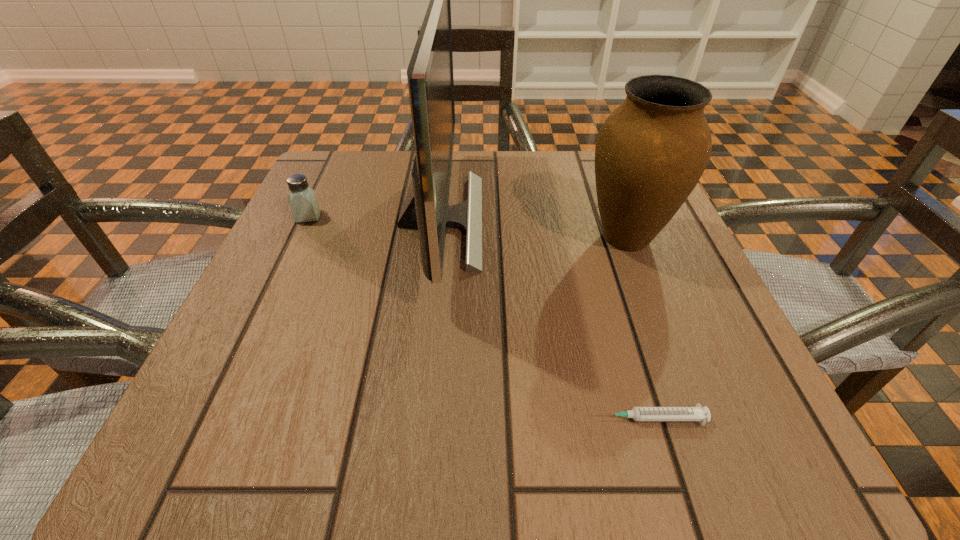
At what (x,y) coordinates should I click in order to perform the action: click on free region located at the needle end of the syringe. Please return your answer as a coordinate pair (x, y). Looking at the image, I should click on click(x=548, y=418).

Locate an element on the screen. free space located 0.350m at the needle end of the syringe is located at coordinates (319, 418).

Locate an element on the screen. vacant space located at the needle end of the syringe is located at coordinates (382, 418).

Where is `monitor that is at the far edge`? The image size is (960, 540). monitor that is at the far edge is located at coordinates (430, 75).

The width and height of the screenshot is (960, 540). I want to click on urn positioned at the far edge, so click(650, 153).

You are a GUI agent. You are given a task and a screenshot of the screen. Output one action in this format:
    pyautogui.click(x=<x>, y=<y>)
    Task: Click on the saltshaker situated at the far edge
    This screenshot has width=960, height=540.
    Given the screenshot: What is the action you would take?
    pyautogui.click(x=303, y=202)

I want to click on object that is positioned at the near edge, so click(x=697, y=413).

Find the location of a particular element. The image size is (960, 540). object at the left edge is located at coordinates (303, 202).

The image size is (960, 540). Find the location of `urn located at the right edge`. urn located at the right edge is located at coordinates (650, 153).

Locate an element on the screen. The image size is (960, 540). syringe situated at the right edge is located at coordinates (697, 413).